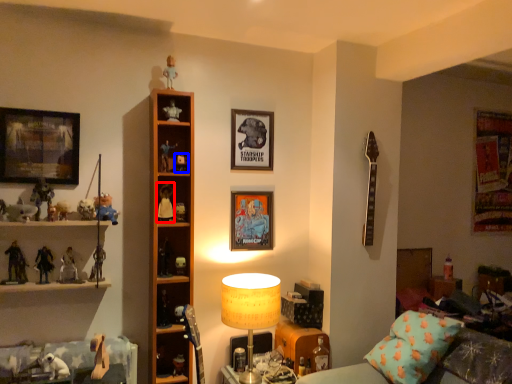
Question: Among these objects, which one is nearest to the camera, toy (highlighted by a red box) or toy (highlighted by a blue box)?

Choices:
 (A) toy
 (B) toy

Answer: (A)